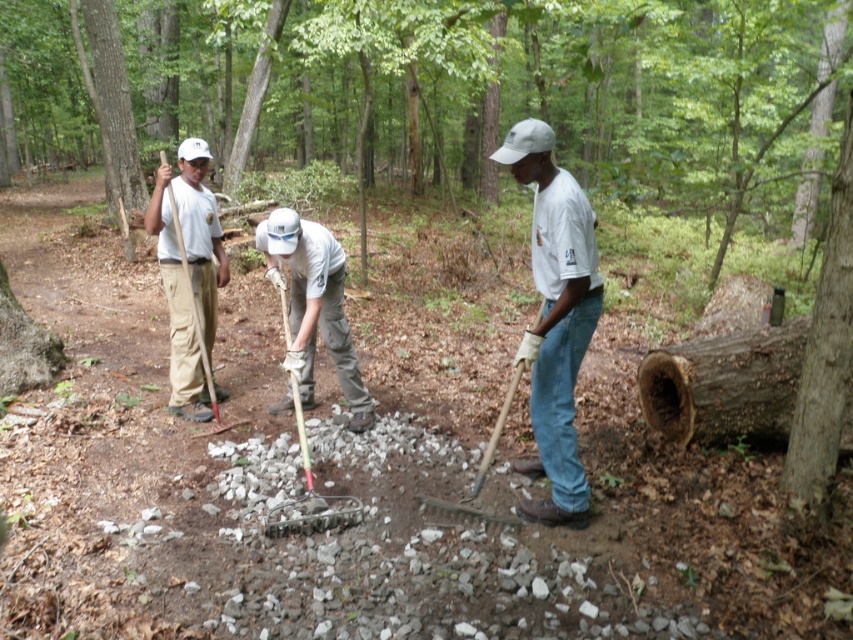
You are standing at the camera position and want to hand a tool to the person wearing the white cotton shirt at center. Considering the distance, can you throw the tool to them without it hitting the ground?

The distance between you and the white cotton shirt at center is 4.90 meters. Throwing a tool that far would likely cause it to hit the ground before reaching them, so it is not advisable to throw it.